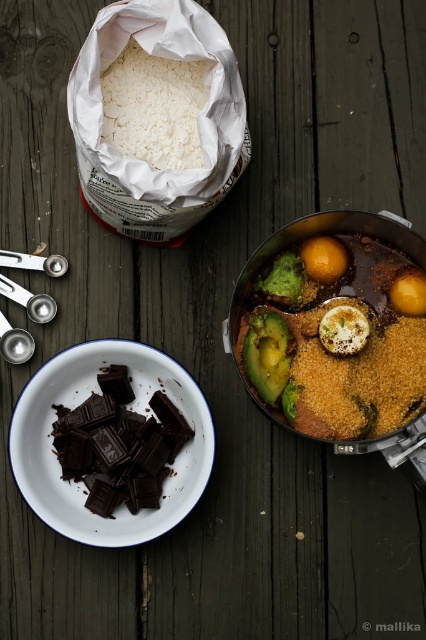
Can you confirm if green matte broccoli at center is wider than brushed metal spoon at lower left?

Yes.

Who is more distant from viewer, (x=290, y=268) or (x=31, y=349)?

Positioned behind is point (x=31, y=349).

Is point (293, 266) positioned in front of point (32, 342)?

That is True.

Locate an element on the screen. The image size is (426, 640). green matte broccoli at center is located at coordinates (284, 280).

Between dark chocolate chunks at bottom left and brushed metal measuring spoon at lower left, which one is positioned lower?

dark chocolate chunks at bottom left

Could you measure the distance between dark chocolate chunks at bottom left and brushed metal measuring spoon at lower left?

A distance of 9.08 inches exists between dark chocolate chunks at bottom left and brushed metal measuring spoon at lower left.

Measure the distance between point [175,372] and camera.

Point [175,372] is 1.13 meters away from camera.

Identify the location of dark chocolate chunks at bottom left. (134, 410).

Is point (108, 358) closer to viewer compared to point (163, 80)?

No, it is behind (163, 80).

Who is higher up, dark chocolate chunks at bottom left or white powdery rice at upper left?

white powdery rice at upper left

From the picture: Who is more forward, (172, 467) or (127, 128)?

Point (127, 128) is more forward.

You are a GUI agent. You are given a task and a screenshot of the screen. Output one action in this format:
    pyautogui.click(x=<x>, y=<y>)
    Task: Click on the dark chocolate chunks at bottom left
    The height and width of the screenshot is (640, 426).
    Given the screenshot: What is the action you would take?
    pyautogui.click(x=134, y=410)